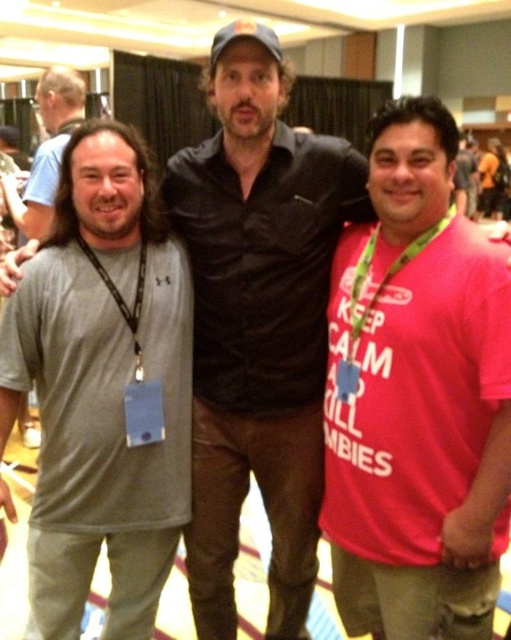
You are standing in the large room and want to move from point A to point B. Point A is at coordinate point (80, 289) and point B is at coordinate point (352, 360). Since you can only move forward, which direction should you turn to reach point B from point A?

Since point A is further to the viewer than point B, you should turn towards the direction of point B which is behind point A. However, since you can only move forward, you need to first move backward to align with point B or adjust your position to face the correct direction before moving forward.